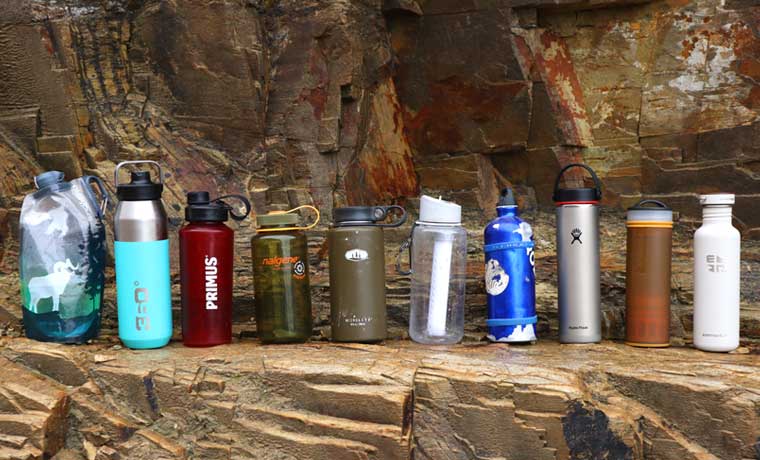
Find the location of a particular element. This screenshot has height=460, width=760. handle is located at coordinates (122, 166), (97, 176), (504, 192), (575, 164), (648, 199).